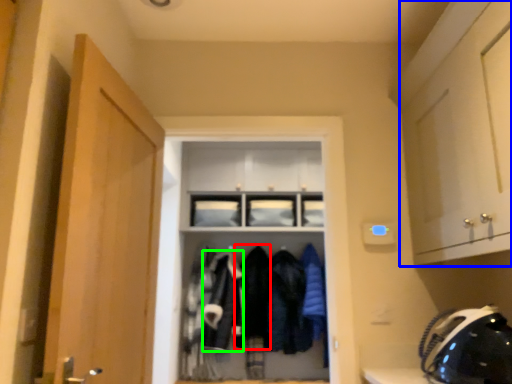
Question: Considering the real-world distances, which object is closest to clothing (highlighted by a red box)? cabinetry (highlighted by a blue box) or clothing (highlighted by a green box).

Choices:
 (A) cabinetry
 (B) clothing

Answer: (B)